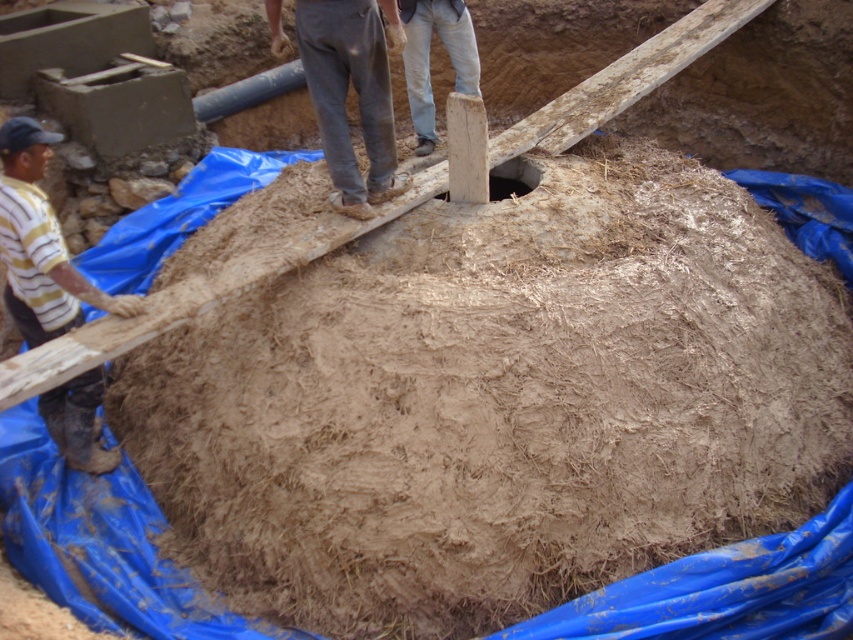
Question: Does gray cotton pants at center have a larger size compared to light beige jeans at upper center?

Choices:
 (A) yes
 (B) no

Answer: (A)

Question: Which point is farther to the camera?

Choices:
 (A) light beige jeans at upper center
 (B) brown dirt hole at center

Answer: (A)

Question: Considering the real-world distances, which object is farthest from the gray cotton pants at center?

Choices:
 (A) brown dirt hole at center
 (B) dirty yellow shirt at left

Answer: (B)

Question: Which point appears farthest from the camera in this image?

Choices:
 (A) (490, 179)
 (B) (347, 131)
 (C) (461, 84)

Answer: (C)

Question: Is dirty yellow shirt at left closer to camera compared to brown dirt hole at center?

Choices:
 (A) yes
 (B) no

Answer: (A)

Question: In this image, where is dirty yellow shirt at left located relative to brown dirt hole at center?

Choices:
 (A) above
 (B) below

Answer: (B)